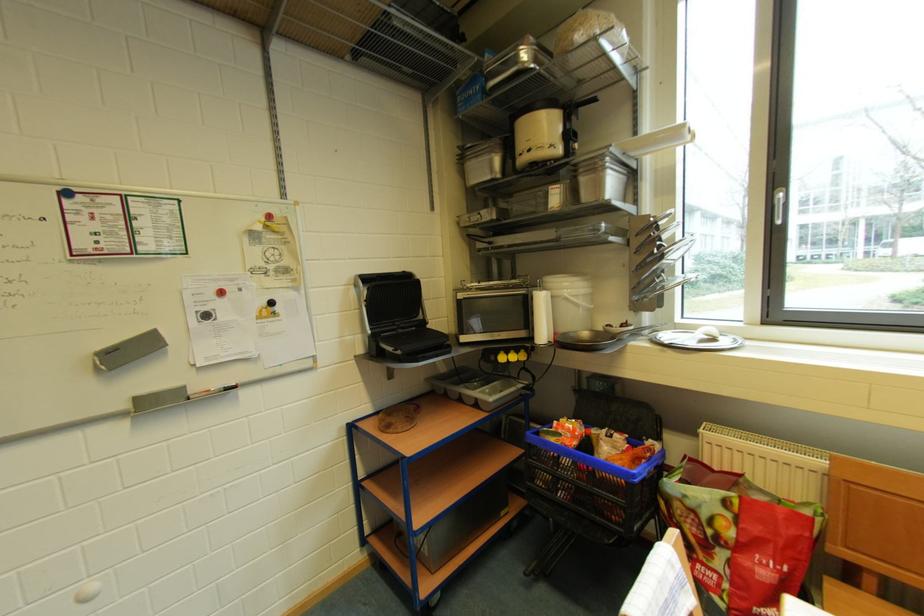
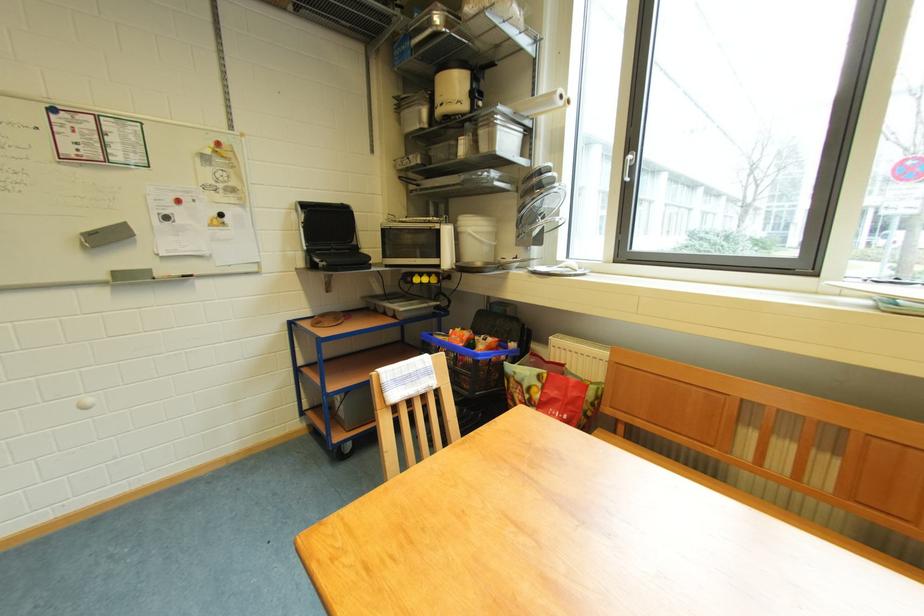
Find the pixel in the second image that matches (x=578, y=299) in the first image.

(481, 235)